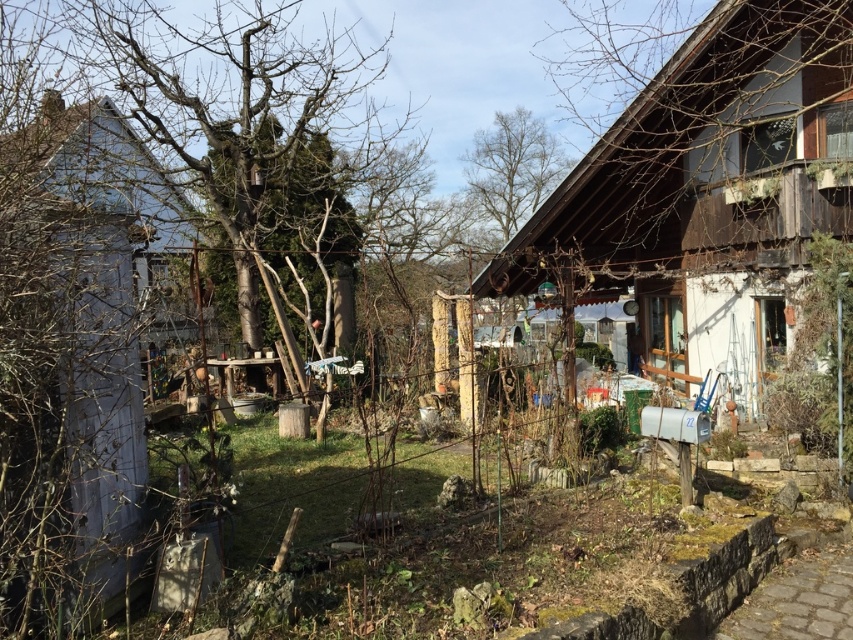
Between point (675, 369) and point (120, 518), which one is positioned in front?

Point (120, 518) is more forward.

What do you see at coordinates (708, 188) in the screenshot? This screenshot has width=853, height=640. I see `wooden hut at right` at bounding box center [708, 188].

The image size is (853, 640). In order to click on wooden hut at right in this screenshot , I will do `click(708, 188)`.

I want to click on wooden hut at right, so click(708, 188).

Can you confirm if white wood hut at left is smaller than bare wood tree at upper center?

Yes, white wood hut at left is smaller than bare wood tree at upper center.

Does white wood hut at left have a greater height compared to bare wood tree at upper center?

In fact, white wood hut at left may be shorter than bare wood tree at upper center.

Which is behind, point (128, 284) or point (531, 145)?

The point (531, 145) is behind.

You are a GUI agent. You are given a task and a screenshot of the screen. Output one action in this format:
    pyautogui.click(x=<x>, y=<y>)
    Task: Click on the white wood hut at left
    Image resolution: width=853 pixels, height=640 pixels.
    Given the screenshot: What is the action you would take?
    pyautogui.click(x=71, y=348)

Who is more forward, (809,211) or (236,241)?

Point (809,211)

Which is below, wooden hut at right or bare branches at left?

wooden hut at right is lower down.

Based on the photo, measure the distance between point (x=790, y=26) and camera.

9.03 meters

I want to click on wooden hut at right, so click(708, 188).